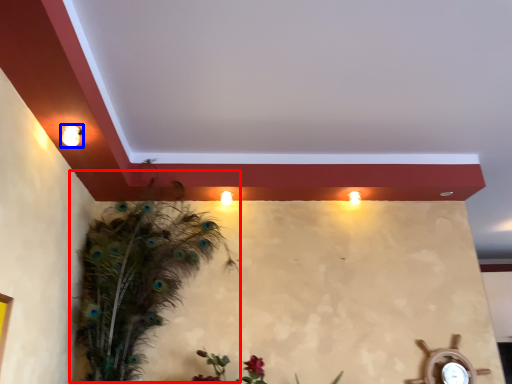
Question: Which object appears farthest to the camera in this image, bird (highlighted by a red box) or light fixture (highlighted by a blue box)?

Choices:
 (A) bird
 (B) light fixture

Answer: (A)